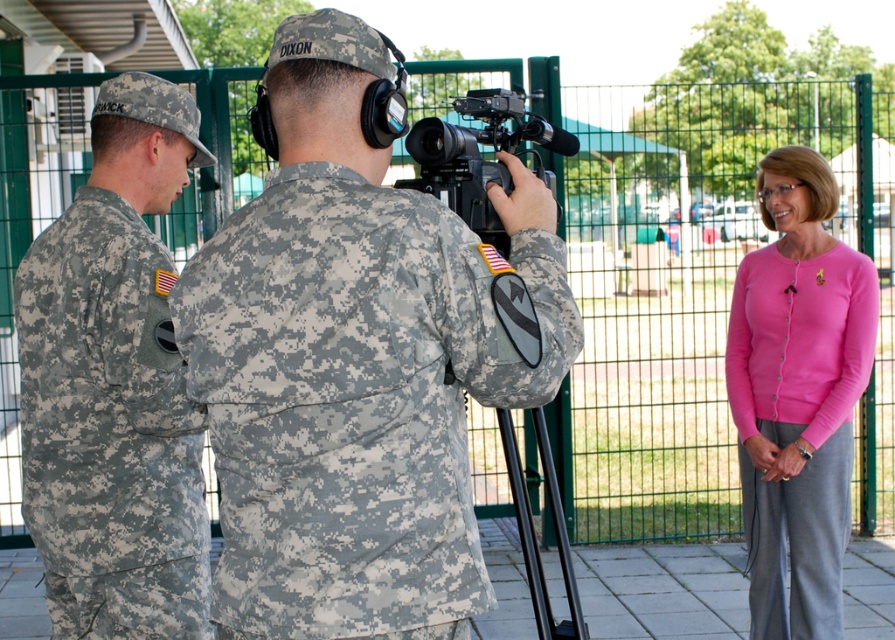
You are a photographer trying to position the subject correctly. The subject is wearing a pink cardigan at right and the camera is the black plastic camera at center. Based on the scene description, is the subject positioned to the right side of the camera?

Yes, the pink cardigan at right is to the right of the black plastic camera at center, so the subject is positioned to the right side of the camera.

In the scene shown: You are a photographer trying to capture a group photo. You see a camouflage uniform at center at point (358, 362). Is this point a good location to place the camouflage uniform for a balanced composition?

The camouflage uniform at center is already positioned at point (358, 362), so placing it there would maintain its current balanced composition.

You are trying to determine if the camouflage uniform at center can completely cover the black plastic camera at center. Based on the spatial relationship between them, is this possible?

The camouflage uniform at center might be wider than black plastic camera at center, so it is possible that the camouflage uniform at center could cover the black plastic camera at center depending on their exact sizes and positioning.